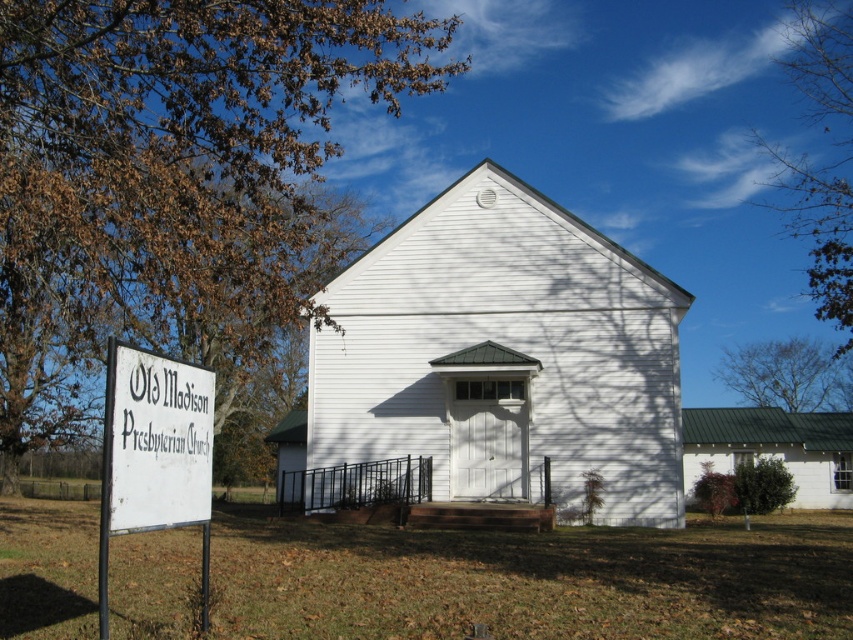
Question: Which is farther from the white wooden sign at left?

Choices:
 (A) white matte building at center
 (B) bare branches at upper right

Answer: (B)

Question: Is brown leafy tree at upper left thinner than brown leafy tree at upper right?

Choices:
 (A) no
 (B) yes

Answer: (A)

Question: Estimate the real-world distances between objects in this image. Which object is closer to the white wooden sign at left?

Choices:
 (A) brown leafy tree at upper left
 (B) white wood chapel at center
 (C) bare branches at upper right
 (D) white matte building at center

Answer: (B)

Question: Where is white wooden sign at left located in relation to bare branches at upper right in the image?

Choices:
 (A) above
 (B) below

Answer: (A)

Question: Which of these objects is positioned closest to the white matte building at center?

Choices:
 (A) bare branches at upper right
 (B) brown leafy tree at upper right
 (C) brown leafy tree at upper left

Answer: (B)

Question: From the image, what is the correct spatial relationship of brown leafy tree at upper right in relation to bare branches at upper right?

Choices:
 (A) left
 (B) right

Answer: (A)